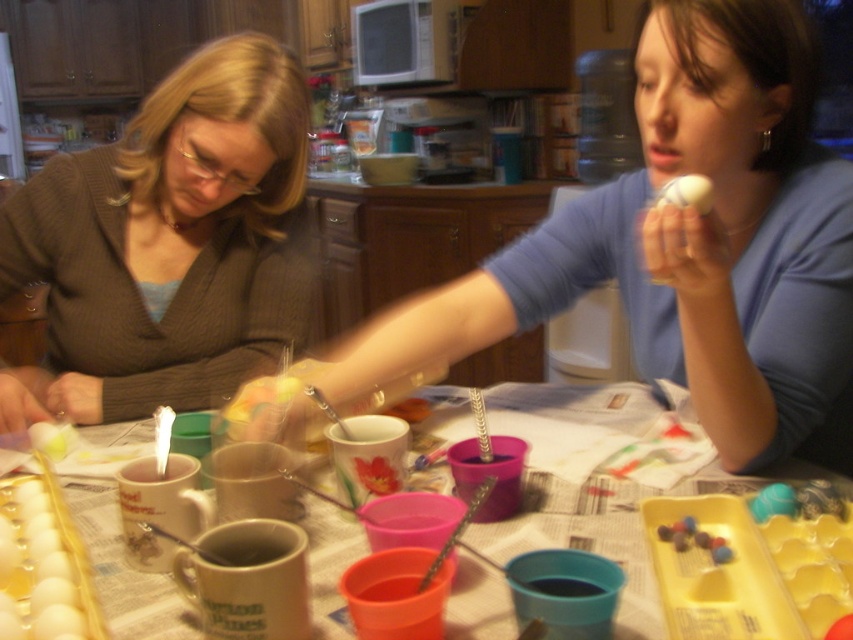
Question: Considering the real-world distances, which object is closest to the smooth white egg at lower left?

Choices:
 (A) matte brown sweater at center
 (B) matte blue shirt at center
 (C) matte yellow egg at upper center
 (D) matte plastic table at center

Answer: (D)

Question: Can you confirm if matte blue shirt at center is bigger than matte yellow egg at upper center?

Choices:
 (A) no
 (B) yes

Answer: (B)

Question: Which point is closer to the camera?

Choices:
 (A) matte plastic table at center
 (B) matte brown sweater at center

Answer: (A)

Question: Where is matte blue shirt at center located in relation to matte yellow egg at upper center in the image?

Choices:
 (A) above
 (B) below

Answer: (B)

Question: Can you confirm if smooth white egg at lower left is positioned to the right of matte yellow egg at upper center?

Choices:
 (A) yes
 (B) no

Answer: (B)

Question: Which point is closer to the camera?

Choices:
 (A) (822, 324)
 (B) (303, 522)
 (C) (708, 195)
 (D) (202, 131)

Answer: (C)